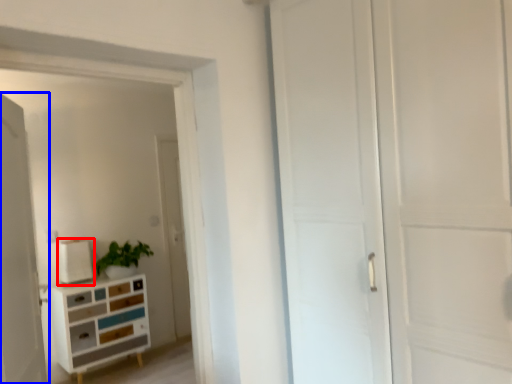
Question: Which object is closer to the camera taking this photo, appliance (highlighted by a red box) or door (highlighted by a blue box)?

Choices:
 (A) appliance
 (B) door

Answer: (B)